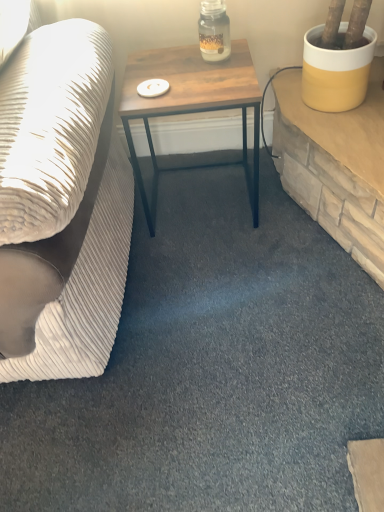
This screenshot has height=512, width=384. In order to click on empty space that is ontop of wooden table at center (from a real-world perspective) in this screenshot , I will do `click(184, 73)`.